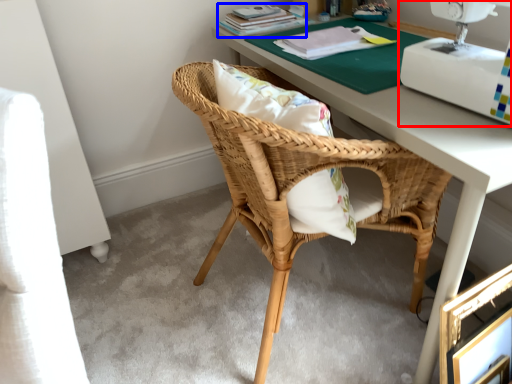
Question: Which object is closer to the camera taking this photo, sewing machine (highlighted by a red box) or book (highlighted by a blue box)?

Choices:
 (A) sewing machine
 (B) book

Answer: (A)